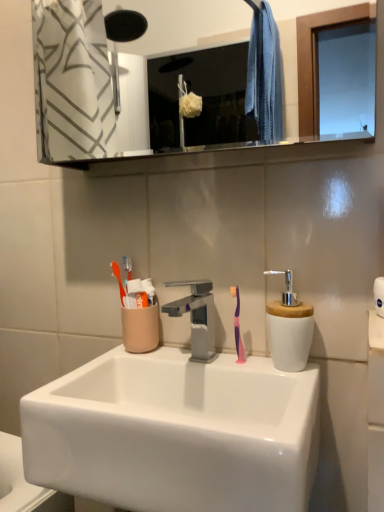
Question: Relative to pink rubber toothbrush at center, is satin nickel faucet at center in front or behind?

Choices:
 (A) behind
 (B) front

Answer: (B)

Question: Does point (195, 358) appear closer or farther from the camera than point (238, 331)?

Choices:
 (A) farther
 (B) closer

Answer: (B)

Question: Based on their relative distances, which object is nearer to the clear glass mirror at upper center?

Choices:
 (A) white ceramic soap dispenser at right
 (B) satin nickel faucet at center
 (C) white glossy sink at center
 (D) white paper towel at right
 (E) pink rubber toothbrush at center

Answer: (B)

Question: Which object is the closest to the white paper towel at right?

Choices:
 (A) satin nickel faucet at center
 (B) white glossy sink at center
 (C) white ceramic soap dispenser at right
 (D) pink rubber toothbrush at center
 (E) clear glass mirror at upper center

Answer: (C)